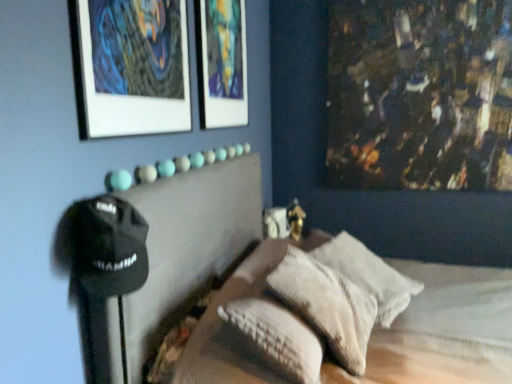
Question: From the image's perspective, is textured beige pillow at center, the second pillow positioned from the back, above or below matte glass picture frame at upper center, the 2th picture frame when ordered from left to right?

Choices:
 (A) above
 (B) below

Answer: (B)

Question: Is textured beige pillow at center, the 1th pillow in the front-to-back sequence, inside the boundaries of matte glass picture frame at upper center, the 2th picture frame when ordered from left to right, or outside?

Choices:
 (A) inside
 (B) outside

Answer: (B)

Question: Which of these objects is positioned closest to the white textured pillow at center, the second pillow in the front-to-back sequence?

Choices:
 (A) textured beige pillow at center, the second pillow positioned from the back
 (B) matte white picture frame at upper left, which is the 2th picture frame from right to left
 (C) matte glass picture frame at upper center, acting as the first picture frame starting from the right

Answer: (A)

Question: Estimate the real-world distances between objects in this image. Which object is farther from the white textured pillow at center, which appears as the 1th pillow when viewed from the back?

Choices:
 (A) matte white picture frame at upper left, which is the 2th picture frame from right to left
 (B) textured beige pillow at center, the 1th pillow in the front-to-back sequence
 (C) matte glass picture frame at upper center, acting as the first picture frame starting from the right

Answer: (A)